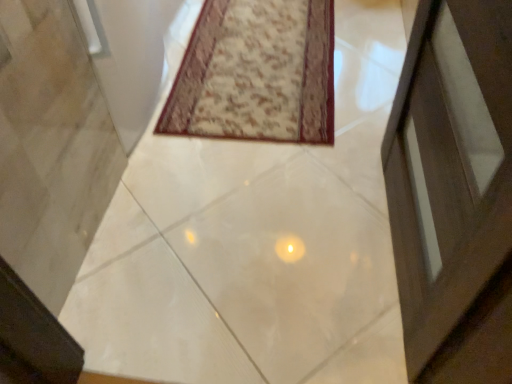
Question: In terms of width, does beige textured rug at center look wider or thinner when compared to white glossy concrete at center?

Choices:
 (A) thin
 (B) wide

Answer: (A)

Question: In terms of size, does beige textured rug at center appear bigger or smaller than white glossy concrete at center?

Choices:
 (A) big
 (B) small

Answer: (B)

Question: In terms of height, does beige textured rug at center look taller or shorter compared to white glossy concrete at center?

Choices:
 (A) tall
 (B) short

Answer: (B)

Question: From a real-world perspective, is white glossy concrete at center above or below beige textured rug at center?

Choices:
 (A) below
 (B) above

Answer: (A)

Question: Do you think white glossy concrete at center is within beige textured rug at center, or outside of it?

Choices:
 (A) inside
 (B) outside

Answer: (B)

Question: In terms of size, does white glossy concrete at center appear bigger or smaller than beige textured rug at center?

Choices:
 (A) small
 (B) big

Answer: (B)

Question: From the image's perspective, is white glossy concrete at center above or below beige textured rug at center?

Choices:
 (A) above
 (B) below

Answer: (B)